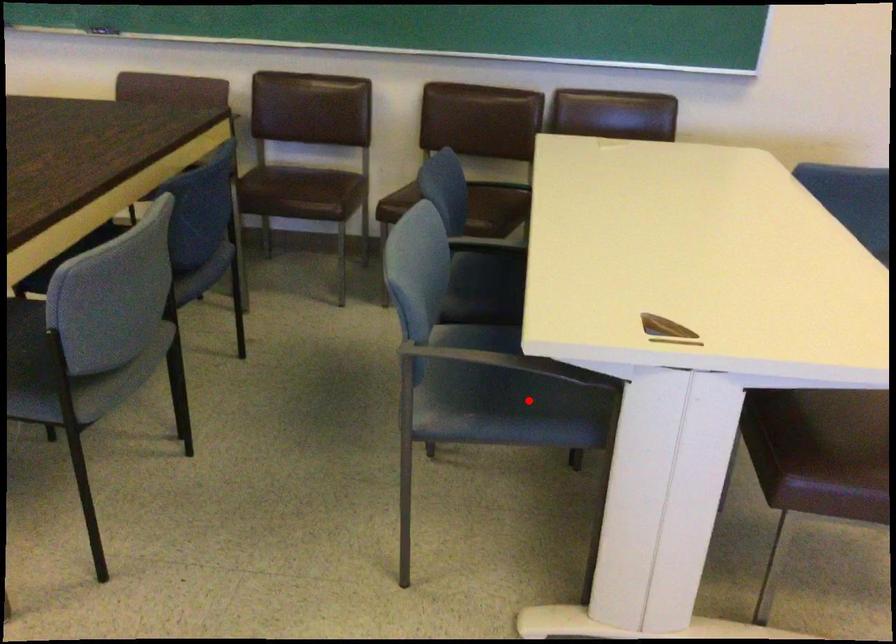
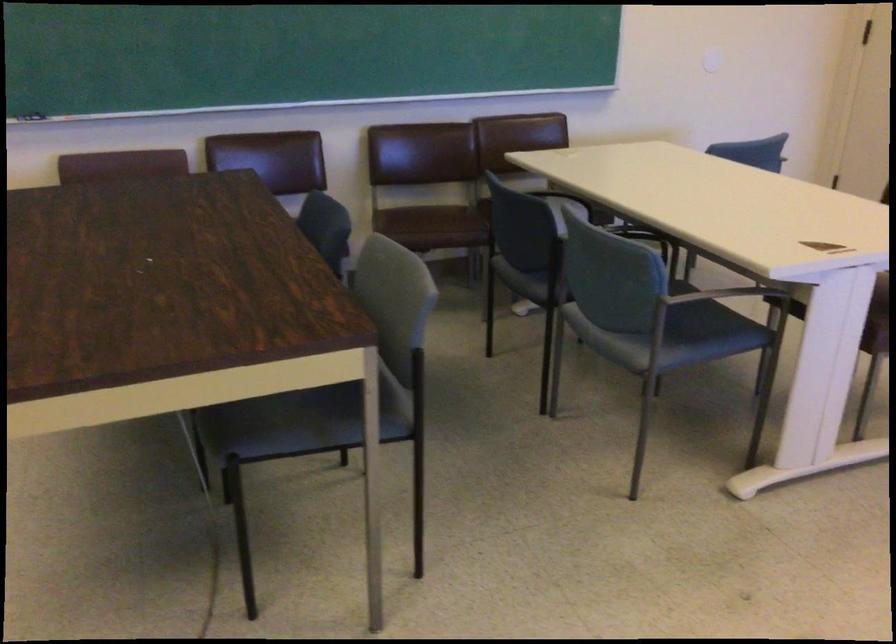
In the second image, find the point that corresponds to the highlighted location in the first image.

(700, 330)